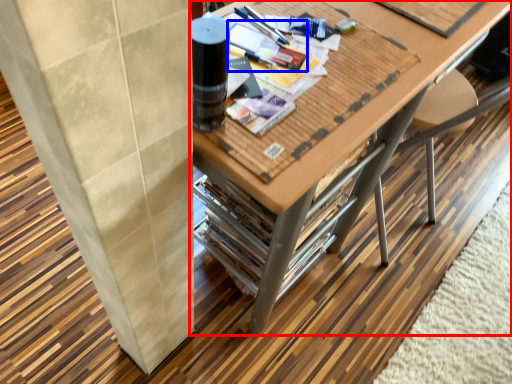
Question: Which object is further to the camera taking this photo, table (highlighted by a red box) or magazine (highlighted by a blue box)?

Choices:
 (A) table
 (B) magazine

Answer: (B)